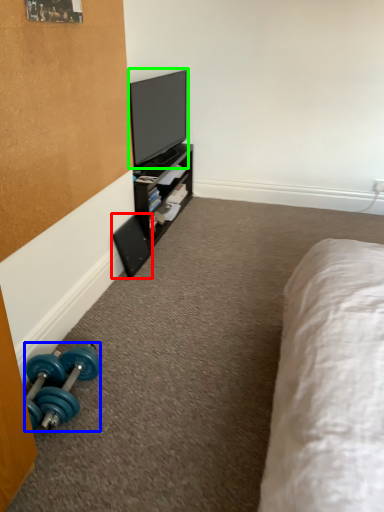
Question: Estimate the real-world distances between objects in this image. Which object is closer to speaker (highlighted by a red box), dumbbell (highlighted by a blue box) or television (highlighted by a green box)?

Choices:
 (A) dumbbell
 (B) television

Answer: (B)